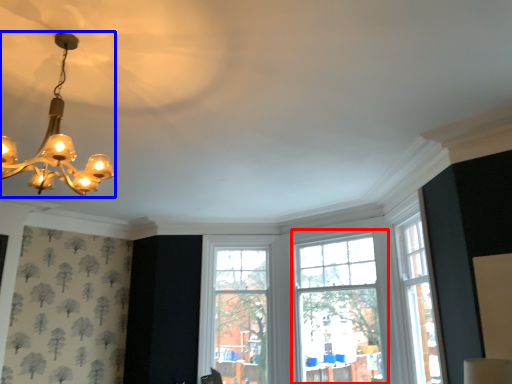
Question: Which object appears farthest to the camera in this image, window (highlighted by a red box) or lamp (highlighted by a blue box)?

Choices:
 (A) window
 (B) lamp

Answer: (A)